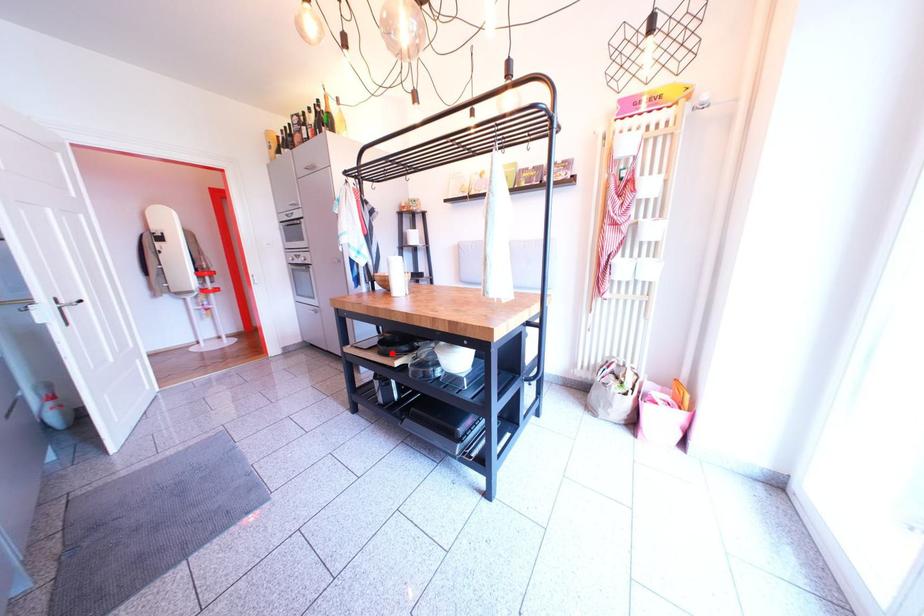
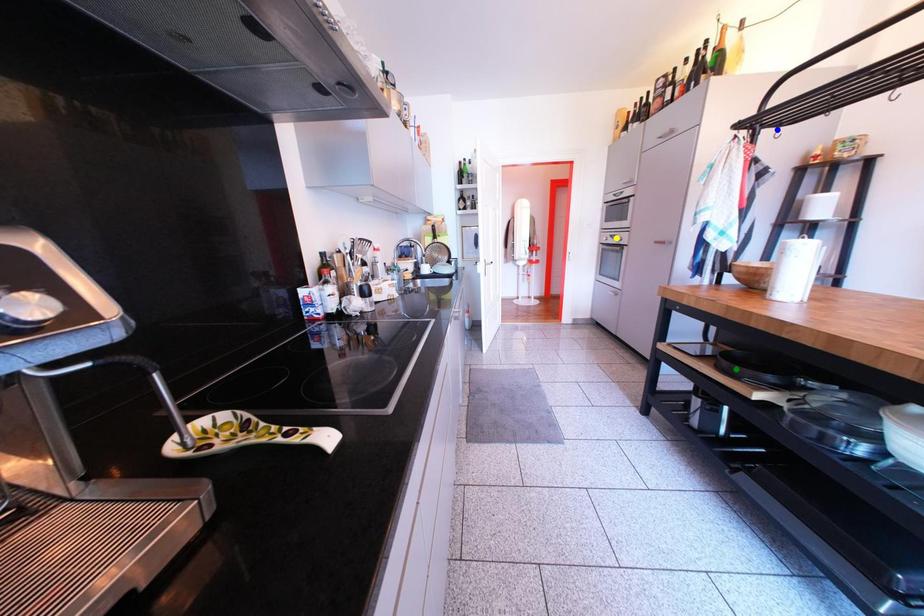
Question: I am providing you with two images of the same scene from different viewpoints. A red point is marked on the first image. You are given multiple points on the second image. In image 2, which mark is for the same physical point as the one in image 1?

Choices:
 (A) blue point
 (B) yellow point
 (C) green point

Answer: (C)